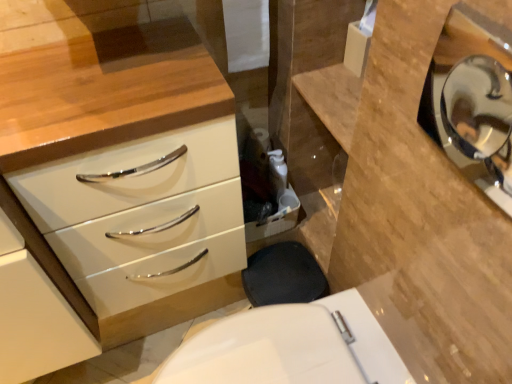
Locate an element on the screen. The height and width of the screenshot is (384, 512). blank space situated above white glossy toilet at lower center (from a real-world perspective) is located at coordinates (259, 352).